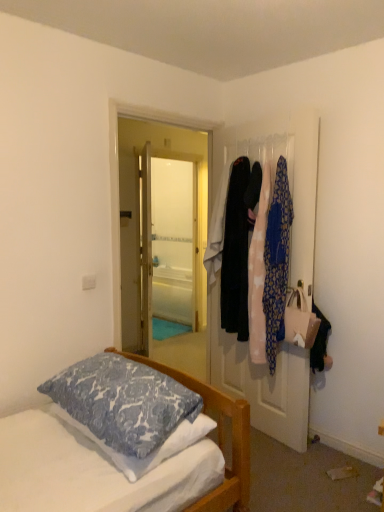
Question: Is white glossy door at center at the right side of blue printed pillow at lower left?

Choices:
 (A) yes
 (B) no

Answer: (A)

Question: Is white glossy door at center behind blue printed pillow at lower left?

Choices:
 (A) yes
 (B) no

Answer: (A)

Question: Considering the relative sizes of white glossy door at center and blue printed pillow at lower left in the image provided, is white glossy door at center thinner than blue printed pillow at lower left?

Choices:
 (A) yes
 (B) no

Answer: (A)

Question: Does white glossy door at center have a lesser height compared to blue printed pillow at lower left?

Choices:
 (A) yes
 (B) no

Answer: (B)

Question: From a real-world perspective, is white glossy door at center over blue printed pillow at lower left?

Choices:
 (A) no
 (B) yes

Answer: (B)

Question: In terms of size, does light pink fabric dress at right, the 2th clothing in the left-to-right sequence, appear bigger or smaller than white glossy door at center?

Choices:
 (A) small
 (B) big

Answer: (A)

Question: In terms of width, does light pink fabric dress at right, the 2th clothing when ordered from right to left, look wider or thinner when compared to white glossy door at center?

Choices:
 (A) thin
 (B) wide

Answer: (B)

Question: From a real-world perspective, is light pink fabric dress at right, the 2th clothing when ordered from right to left, physically located above or below white glossy door at center?

Choices:
 (A) below
 (B) above

Answer: (B)

Question: Is light pink fabric dress at right, the 2th clothing when ordered from right to left, taller or shorter than white glossy door at center?

Choices:
 (A) short
 (B) tall

Answer: (A)

Question: In terms of width, does white glossy door at center look wider or thinner when compared to black velvet coat at right, which ranks as the 3th clothing in right-to-left order?

Choices:
 (A) thin
 (B) wide

Answer: (A)

Question: Is point (306, 228) positioned closer to the camera than point (228, 311)?

Choices:
 (A) closer
 (B) farther

Answer: (A)

Question: In the image, is white glossy door at center on the left side or the right side of black velvet coat at right, which ranks as the 3th clothing in right-to-left order?

Choices:
 (A) left
 (B) right

Answer: (B)

Question: From a real-world perspective, is white glossy door at center above or below black velvet coat at right, which ranks as the 3th clothing in right-to-left order?

Choices:
 (A) below
 (B) above

Answer: (A)

Question: Would you say patterned fabric clothesline at upper right is inside or outside blue printed pillow at lower left?

Choices:
 (A) outside
 (B) inside

Answer: (A)

Question: Relative to blue printed pillow at lower left, is patterned fabric clothesline at upper right in front or behind?

Choices:
 (A) behind
 (B) front

Answer: (A)